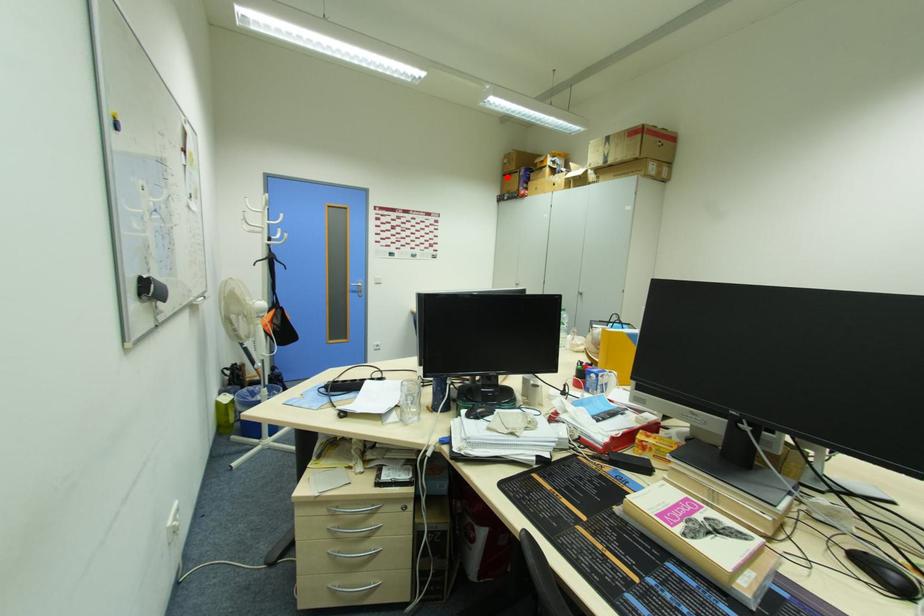
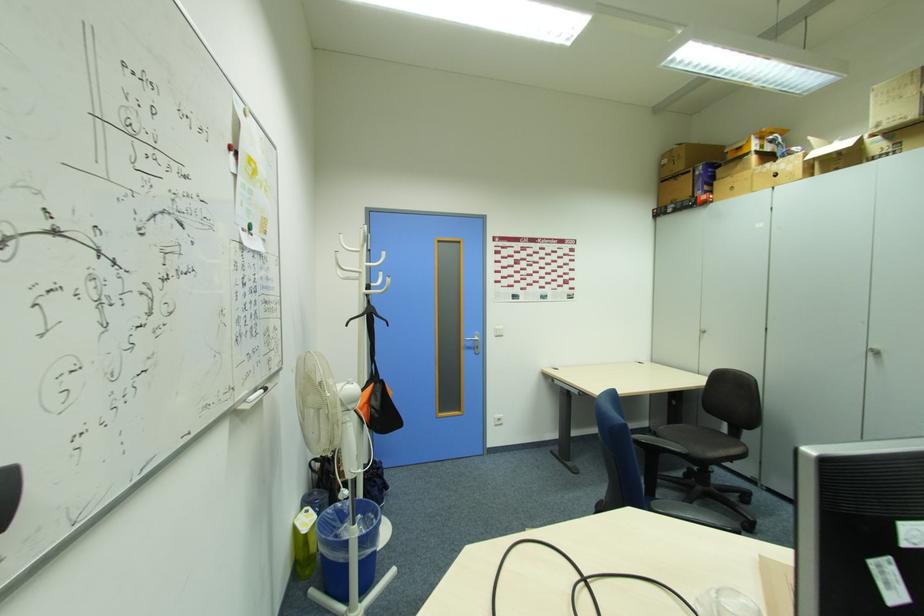
Find the pixel in the second image that matches the highlighted location in the first image.

(665, 182)